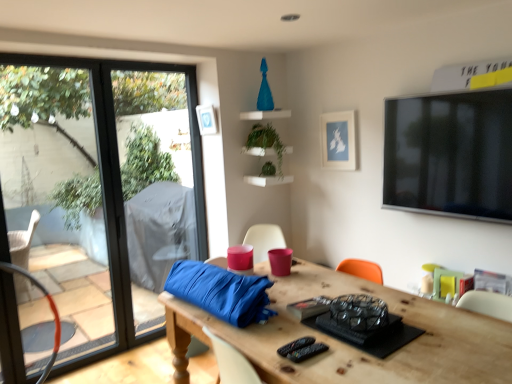
What do you see at coordinates (268, 169) in the screenshot? The image size is (512, 384). I see `green matte plant at center, arranged as the first plant when ordered from the bottom` at bounding box center [268, 169].

This screenshot has width=512, height=384. What do you see at coordinates (50, 308) in the screenshot? I see `metallic orange swivel chair at left` at bounding box center [50, 308].

The width and height of the screenshot is (512, 384). Find the location of `wooden table at center`. wooden table at center is located at coordinates (348, 345).

Describe the element at coordinates (348, 345) in the screenshot. The width and height of the screenshot is (512, 384). I see `wooden table at center` at that location.

Consider the image. How much space does blue matte picture frame at upper center, which is the first picture frame from left to right, occupy horizontally?

The width of blue matte picture frame at upper center, which is the first picture frame from left to right, is 1.95 inches.

I want to click on green matte plant at center, arranged as the 2th plant when viewed from the top, so click(268, 169).

Considering the relative positions of transparent glass window at left and green matte plant at center, which is counted as the second plant, starting from the bottom, in the image provided, is transparent glass window at left to the left of green matte plant at center, which is counted as the second plant, starting from the bottom, from the viewer's perspective?

Yes, transparent glass window at left is to the left of green matte plant at center, which is counted as the second plant, starting from the bottom.

From the image's perspective, who appears lower, transparent glass window at left or green matte plant at center, the 1th plant from the top?

transparent glass window at left is shown below in the image.

Does transparent glass window at left turn towards green matte plant at center, which is counted as the second plant, starting from the bottom?

No, transparent glass window at left is not aimed at green matte plant at center, which is counted as the second plant, starting from the bottom.

Which object is thinner, transparent glass window at left or green matte plant at center, which is counted as the second plant, starting from the bottom?

Thinner between the two is transparent glass window at left.

Between wooden table at center and blue matte picture frame at upper center, placed as the 2th picture frame when sorted from right to left, which one appears on the left side from the viewer's perspective?

Result: From the viewer's perspective, blue matte picture frame at upper center, placed as the 2th picture frame when sorted from right to left, appears more on the left side.

Considering the sizes of objects wooden table at center and blue matte picture frame at upper center, placed as the 2th picture frame when sorted from right to left, in the image provided, who is bigger, wooden table at center or blue matte picture frame at upper center, placed as the 2th picture frame when sorted from right to left,?

wooden table at center is bigger.

Considering the positions of point (187, 375) and point (203, 135), is point (187, 375) closer or farther from the camera than point (203, 135)?

Point (187, 375) is closer to the camera than point (203, 135).

In the scene shown: Can you confirm if wooden table at center is wider than blue matte picture frame at upper center, placed as the 2th picture frame when sorted from right to left?

Yes, wooden table at center is wider than blue matte picture frame at upper center, placed as the 2th picture frame when sorted from right to left.

Is wooden table at center located outside matte blue picture frame at upper center, the 2th picture frame viewed from the left?

That's correct, wooden table at center is outside of matte blue picture frame at upper center, the 2th picture frame viewed from the left.

Are wooden table at center and matte blue picture frame at upper center, the 2th picture frame viewed from the left, far apart?

Yes, wooden table at center and matte blue picture frame at upper center, the 2th picture frame viewed from the left, are quite far apart.

Which is nearer, (x=495, y=370) or (x=324, y=133)?

Point (x=495, y=370).

Could you tell me if blue matte picture frame at upper center, which is the first picture frame from left to right, is facing transparent glass window at left?

No, blue matte picture frame at upper center, which is the first picture frame from left to right, is not turned towards transparent glass window at left.

From the image's perspective, relative to transparent glass window at left, is blue matte picture frame at upper center, which is the first picture frame from left to right, above or below?

From the image's perspective, blue matte picture frame at upper center, which is the first picture frame from left to right, appears above transparent glass window at left.

Considering the positions of objects metallic orange swivel chair at left and blue matte picture frame at upper center, which is the first picture frame from left to right, in the image provided, who is more to the left, metallic orange swivel chair at left or blue matte picture frame at upper center, which is the first picture frame from left to right,?

From the viewer's perspective, metallic orange swivel chair at left appears more on the left side.

Is metallic orange swivel chair at left turned away from blue matte picture frame at upper center, placed as the 2th picture frame when sorted from right to left?

That's not correct — metallic orange swivel chair at left is not looking away from blue matte picture frame at upper center, placed as the 2th picture frame when sorted from right to left.

Is metallic orange swivel chair at left situated inside blue matte picture frame at upper center, placed as the 2th picture frame when sorted from right to left, or outside?

metallic orange swivel chair at left cannot be found inside blue matte picture frame at upper center, placed as the 2th picture frame when sorted from right to left.

The width and height of the screenshot is (512, 384). What are the coordinates of `table below the transparent glass window at left (from a real-world perspective)` in the screenshot? It's located at (348, 345).

Is wooden table at center far away from transparent glass window at left?

Yes, wooden table at center and transparent glass window at left are located far from each other.

Between wooden table at center and transparent glass window at left, which one has smaller size?

Smaller between the two is transparent glass window at left.

Can you confirm if wooden table at center is positioned to the left of transparent glass window at left?

Incorrect, wooden table at center is not on the left side of transparent glass window at left.

Between point (412, 373) and point (266, 169), which one is positioned behind?

The point (266, 169) is farther from the camera.

How many degrees apart are the facing directions of wooden table at center and green matte plant at center, arranged as the 2th plant when viewed from the top?

The facing directions of wooden table at center and green matte plant at center, arranged as the 2th plant when viewed from the top, are 90.1 degrees apart.

At what (x,y) coordinates should I click in order to perform the action: click on table below the green matte plant at center, arranged as the first plant when ordered from the bottom (from a real-world perspective). Please return your answer as a coordinate pair (x, y). The image size is (512, 384). Looking at the image, I should click on pos(348,345).

Where is `the 2nd plant located above the transparent glass window at left (from a real-world perspective)`? This screenshot has height=384, width=512. the 2nd plant located above the transparent glass window at left (from a real-world perspective) is located at coordinates (266, 141).

Locate an element on the screen. The image size is (512, 384). table below the blue matte picture frame at upper center, which is the first picture frame from left to right (from the image's perspective) is located at coordinates (348, 345).

From the image, which object appears to be farther from blue matte picture frame at upper center, which is the first picture frame from left to right, transparent glass window at left or wooden table at center?

wooden table at center is positioned further to the anchor blue matte picture frame at upper center, which is the first picture frame from left to right.

Which object lies further to the anchor point green matte plant at center, arranged as the first plant when ordered from the bottom, blue matte picture frame at upper center, which is the first picture frame from left to right, or matte blue picture frame at upper center, which is the 1th picture frame from right to left?

Among the two, matte blue picture frame at upper center, which is the 1th picture frame from right to left, is located further to green matte plant at center, arranged as the first plant when ordered from the bottom.

Based on their spatial positions, is matte blue picture frame at upper center, which is the 1th picture frame from right to left, or transparent glass window at left further from wooden table at center?

Among the two, transparent glass window at left is located further to wooden table at center.

Based on their spatial positions, is wooden table at center or green matte plant at center, the 1th plant from the top, further from blue matte picture frame at upper center, placed as the 2th picture frame when sorted from right to left?

A: wooden table at center is further to blue matte picture frame at upper center, placed as the 2th picture frame when sorted from right to left.

When comparing their distances from green matte plant at center, the 1th plant from the top, does transparent glass window at left or wooden table at center seem further?

wooden table at center is further to green matte plant at center, the 1th plant from the top.

Based on their spatial positions, is green matte plant at center, the 1th plant from the top, or wooden table at center closer to metallic orange swivel chair at left?

wooden table at center.

Considering their positions, is green matte plant at center, arranged as the 2th plant when viewed from the top, positioned closer to green matte plant at center, the 1th plant from the top, than matte blue picture frame at upper center, the 2th picture frame viewed from the left?

The object closer to green matte plant at center, the 1th plant from the top, is green matte plant at center, arranged as the 2th plant when viewed from the top.

Based on their spatial positions, is green matte plant at center, which is counted as the second plant, starting from the bottom, or green matte plant at center, arranged as the first plant when ordered from the bottom, further from blue matte picture frame at upper center, placed as the 2th picture frame when sorted from right to left?

green matte plant at center, arranged as the first plant when ordered from the bottom, is positioned further to the anchor blue matte picture frame at upper center, placed as the 2th picture frame when sorted from right to left.

The image size is (512, 384). Identify the location of plant located between blue matte picture frame at upper center, which is the first picture frame from left to right, and green matte plant at center, the 1th plant from the top, in the left-right direction. (268, 169).

You are a GUI agent. You are given a task and a screenshot of the screen. Output one action in this format:
    pyautogui.click(x=<x>, y=<y>)
    Task: Click on the window between metallic orange swivel chair at left and wooden table at center
    
    Given the screenshot: What is the action you would take?
    pyautogui.click(x=96, y=187)

Where is `window between wooden table at center and matte blue picture frame at upper center, which is the 1th picture frame from right to left, in the front-back direction`? window between wooden table at center and matte blue picture frame at upper center, which is the 1th picture frame from right to left, in the front-back direction is located at coordinates (96, 187).

Find the location of a particular element. This screenshot has height=384, width=512. plant between transparent glass window at left and green matte plant at center, which is counted as the second plant, starting from the bottom, in the horizontal direction is located at coordinates pos(268,169).